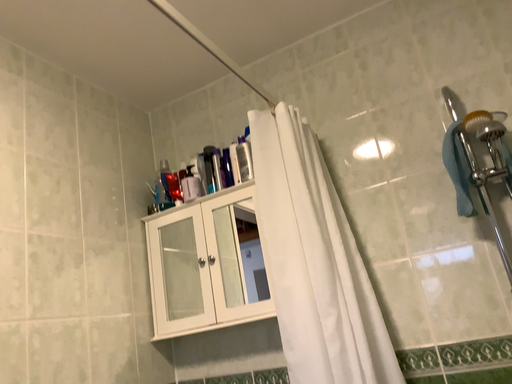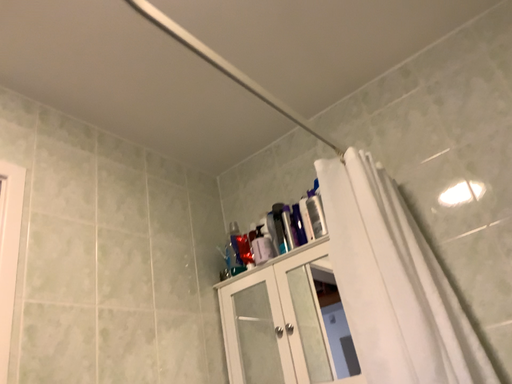
Question: How did the camera likely rotate when shooting the video?

Choices:
 (A) rotated left
 (B) rotated right

Answer: (A)